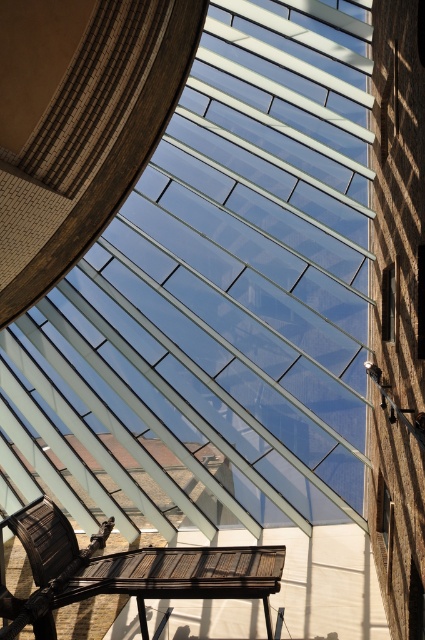
Question: Is wooden slats bench at lower center further to camera compared to brown tile roof at center?

Choices:
 (A) no
 (B) yes

Answer: (A)

Question: Which object appears farthest from the camera in this image?

Choices:
 (A) brown tile roof at center
 (B) wooden slats bench at lower center

Answer: (A)

Question: Is wooden slats bench at lower center bigger than brown tile roof at center?

Choices:
 (A) no
 (B) yes

Answer: (B)

Question: Which of the following is the farthest from the observer?

Choices:
 (A) (197, 580)
 (B) (158, 449)

Answer: (B)

Question: Which of the following is the closest to the observer?

Choices:
 (A) (62, 468)
 (B) (150, 582)

Answer: (B)

Question: Can you confirm if wooden slats bench at lower center is positioned above brown tile roof at center?

Choices:
 (A) no
 (B) yes

Answer: (A)